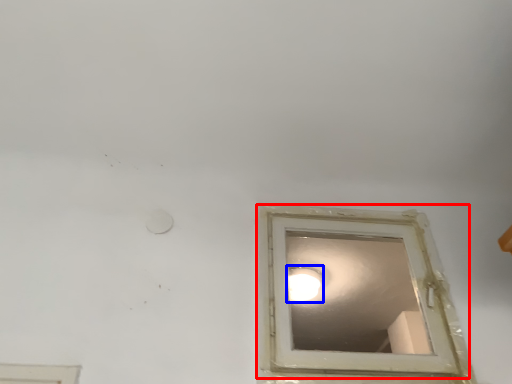
Question: Which object appears closest to the camera in this image, window (highlighted by a red box) or lighting (highlighted by a blue box)?

Choices:
 (A) window
 (B) lighting

Answer: (A)